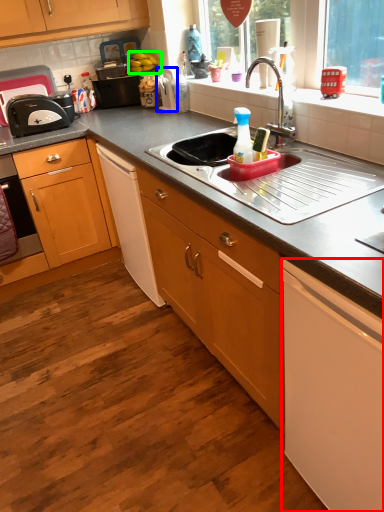
Question: Which is nearer to the cabinetry (highlighted by a red box)? appliance (highlighted by a blue box) or fruit (highlighted by a green box).

Choices:
 (A) appliance
 (B) fruit

Answer: (A)